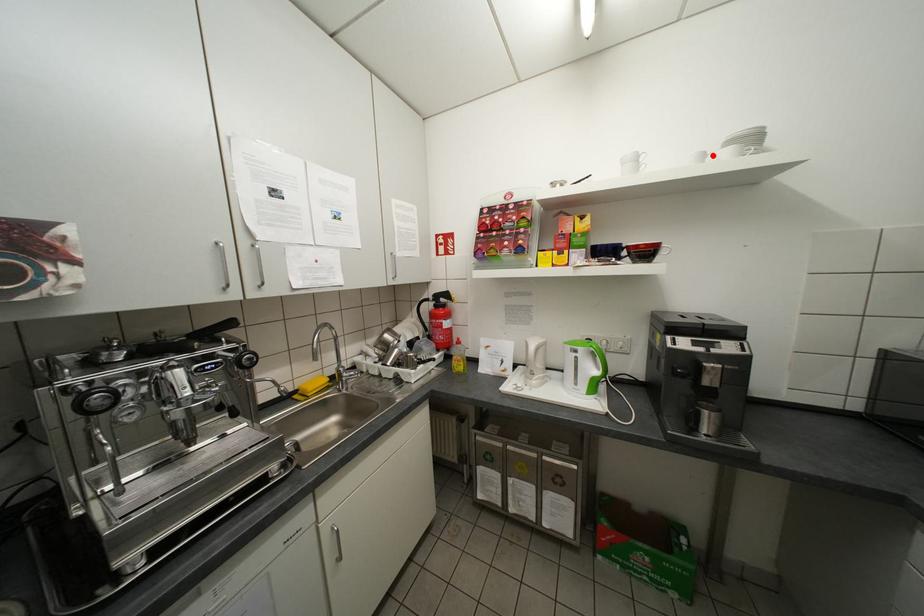
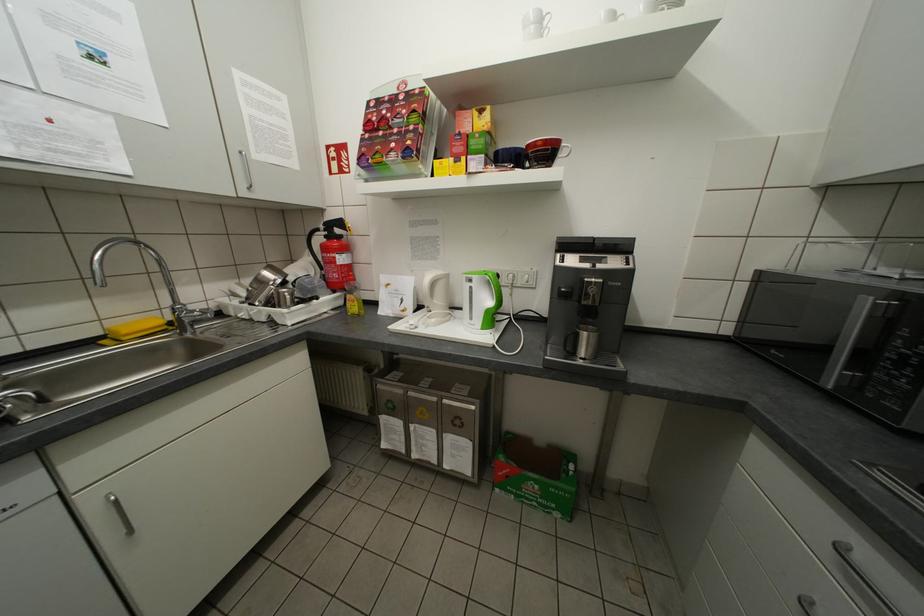
Where in the second image is the point corresponding to the highlighted location from the first image?

(623, 17)